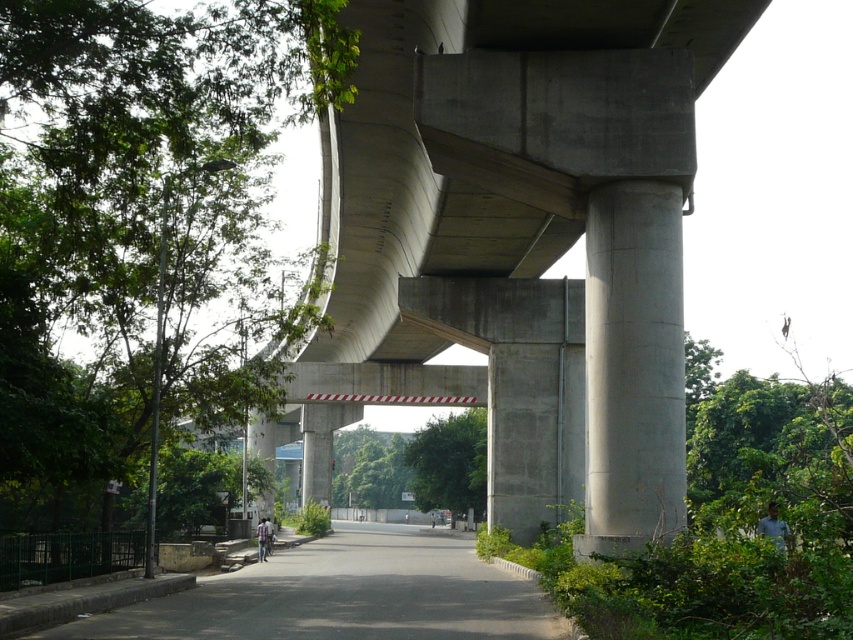
Image resolution: width=853 pixels, height=640 pixels. Describe the element at coordinates (344, 595) in the screenshot. I see `black asphalt road at center` at that location.

Where is `black asphalt road at center`? black asphalt road at center is located at coordinates (344, 595).

Between point (459, 141) and point (486, 609), which one is positioned in front?

Point (486, 609)

Which of these two, concrete at center or black asphalt road at center, stands taller?

concrete at center is taller.

Measure the distance between point [695,157] and camera.

Point [695,157] and camera are 61.12 feet apart from each other.

Find the location of a particular element. The width and height of the screenshot is (853, 640). concrete at center is located at coordinates (524, 236).

Which is in front, point (552, 451) or point (662, 248)?

Point (662, 248) is more forward.

Does point (462, 224) lie in front of point (616, 244)?

No, it is behind (616, 244).

Between point (471, 326) and point (624, 512), which one is positioned in front?

Point (624, 512) is more forward.

You are a GUI agent. You are given a task and a screenshot of the screen. Output one action in this format:
    pyautogui.click(x=<x>, y=<y>)
    Task: Click on the concrete at center
    The width and height of the screenshot is (853, 640).
    Given the screenshot: What is the action you would take?
    pyautogui.click(x=524, y=236)